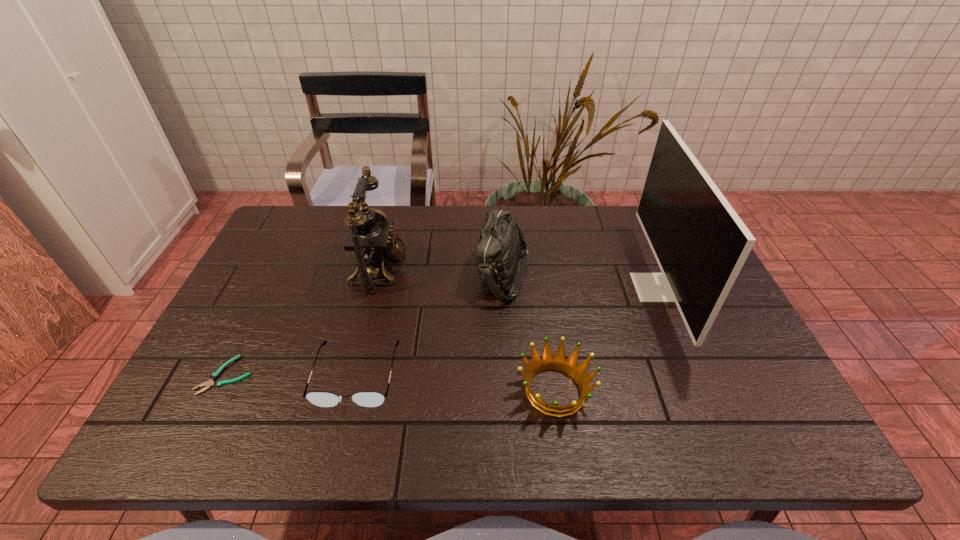
This screenshot has width=960, height=540. In order to click on unoccupied position between the telephone and the third shortest object in this screenshot , I will do `click(468, 330)`.

Find the location of a particular element. The width and height of the screenshot is (960, 540). vacant area that lies between the crown and the fourth shortest object is located at coordinates (529, 333).

Identify the location of vacant region between the second shortest object and the fourth shortest object. The height and width of the screenshot is (540, 960). (430, 325).

At what (x,y) coordinates should I click in order to perform the action: click on vacant area that lies between the third tallest object and the leftmost object. Please return your answer as a coordinate pair (x, y). This screenshot has height=540, width=960. Looking at the image, I should click on (365, 325).

Find the location of `empty space between the second tallest object and the shoulder bag`. empty space between the second tallest object and the shoulder bag is located at coordinates (442, 272).

This screenshot has width=960, height=540. Identify the location of vacant area that lies between the second tallest object and the fifth tallest object. (368, 322).

The width and height of the screenshot is (960, 540). Find the location of `free space between the fourth tallest object and the spectacles`. free space between the fourth tallest object and the spectacles is located at coordinates (456, 383).

You are a GUI agent. You are given a task and a screenshot of the screen. Output one action in this format:
    pyautogui.click(x=<x>, y=<y>)
    Task: Click on the free space between the monitor and the second shortest object
    The width and height of the screenshot is (960, 540).
    Given the screenshot: What is the action you would take?
    pyautogui.click(x=506, y=331)

Locate an element on the screen. vacant region between the second shortest object and the fifth shortest object is located at coordinates (368, 322).

The image size is (960, 540). In order to click on the closest object relative to the second shortest object in this screenshot , I will do `click(215, 375)`.